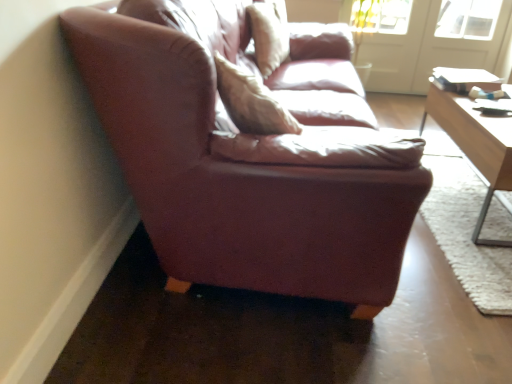
Question: From a real-world perspective, is leather pillow at center located higher than white glossy door at upper right, the second screen door when ordered from left to right?

Choices:
 (A) no
 (B) yes

Answer: (B)

Question: Is leather pillow at center positioned with its back to white glossy door at upper right, the first screen door positioned from the right?

Choices:
 (A) no
 (B) yes

Answer: (A)

Question: Does leather pillow at center lie in front of white glossy door at upper right, the second screen door when ordered from left to right?

Choices:
 (A) no
 (B) yes

Answer: (B)

Question: Is leather pillow at center behind white glossy door at upper right, the first screen door positioned from the right?

Choices:
 (A) no
 (B) yes

Answer: (A)

Question: From the image's perspective, would you say leather pillow at center is positioned over white glossy door at upper right, the second screen door when ordered from left to right?

Choices:
 (A) yes
 (B) no

Answer: (B)

Question: Does leather pillow at center have a larger size compared to white glossy door at upper right, the second screen door when ordered from left to right?

Choices:
 (A) yes
 (B) no

Answer: (B)

Question: Does white glossy door at upper right, the first screen door positioned from the right, have a lesser height compared to light brown wooden table at right?

Choices:
 (A) no
 (B) yes

Answer: (A)

Question: Considering the relative sizes of white glossy door at upper right, the first screen door positioned from the right, and light brown wooden table at right in the image provided, is white glossy door at upper right, the first screen door positioned from the right, wider than light brown wooden table at right?

Choices:
 (A) yes
 (B) no

Answer: (B)

Question: Considering the relative positions of white glossy door at upper right, the second screen door when ordered from left to right, and light brown wooden table at right in the image provided, is white glossy door at upper right, the second screen door when ordered from left to right, behind light brown wooden table at right?

Choices:
 (A) yes
 (B) no

Answer: (A)

Question: Considering the relative positions of white glossy door at upper right, the first screen door positioned from the right, and light brown wooden table at right in the image provided, is white glossy door at upper right, the first screen door positioned from the right, to the right of light brown wooden table at right from the viewer's perspective?

Choices:
 (A) no
 (B) yes

Answer: (B)

Question: Is the position of white glossy door at upper right, the second screen door when ordered from left to right, less distant than that of light brown wooden table at right?

Choices:
 (A) yes
 (B) no

Answer: (B)

Question: Is light brown wooden table at right surrounded by white glossy door at upper right, the second screen door when ordered from left to right?

Choices:
 (A) no
 (B) yes

Answer: (A)

Question: Is leather couch at left turned away from light brown wooden table at right?

Choices:
 (A) yes
 (B) no

Answer: (B)